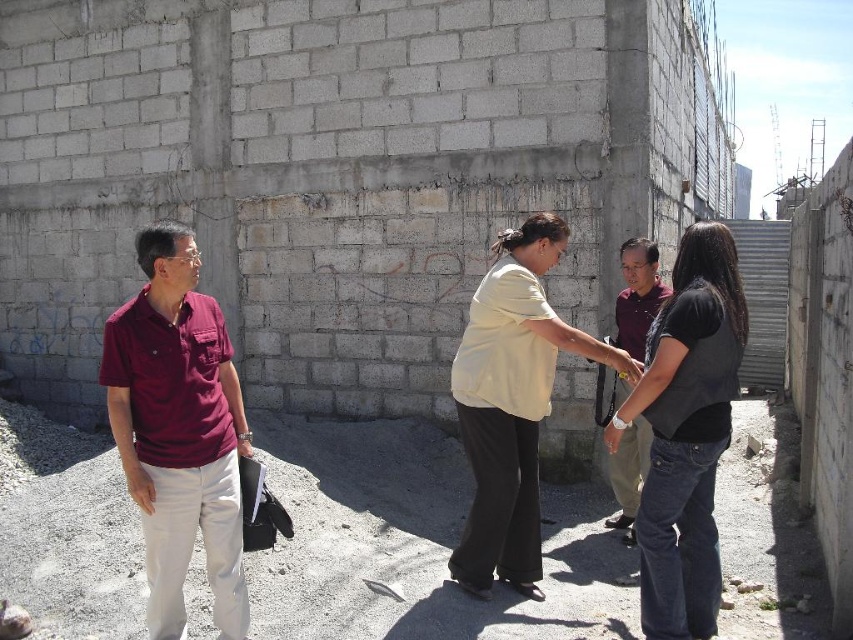
You are an observer at the construction site. You notice two shirts among the people present. The maroon fabric shirt at left and the light yellow cotton shirt at center. Which shirt has a larger size?

The light yellow cotton shirt at center has a larger size compared to the maroon fabric shirt at left.

You are a construction worker trying to determine which maroon shirt is more suitable for a tight workspace. Given that the maroon fabric shirt at left and the maroon shirt at center are both available, which one is narrower and thus better suited for navigating narrow areas?

The maroon shirt at center is narrower than the maroon fabric shirt at left, making it better suited for tight spaces.